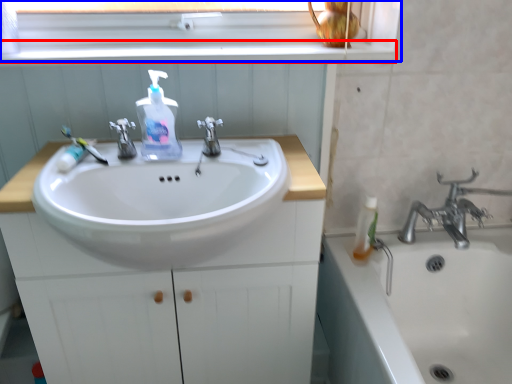
Question: Which object is further to the camera taking this photo, window sill (highlighted by a red box) or window frame (highlighted by a blue box)?

Choices:
 (A) window sill
 (B) window frame

Answer: (B)